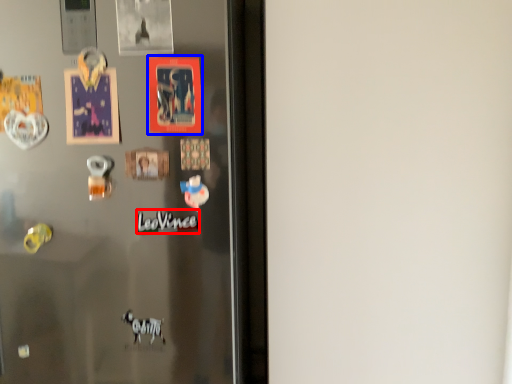
Question: Which of the following is the closest to the observer, writing (highlighted by a red box) or postcard (highlighted by a blue box)?

Choices:
 (A) writing
 (B) postcard

Answer: (B)